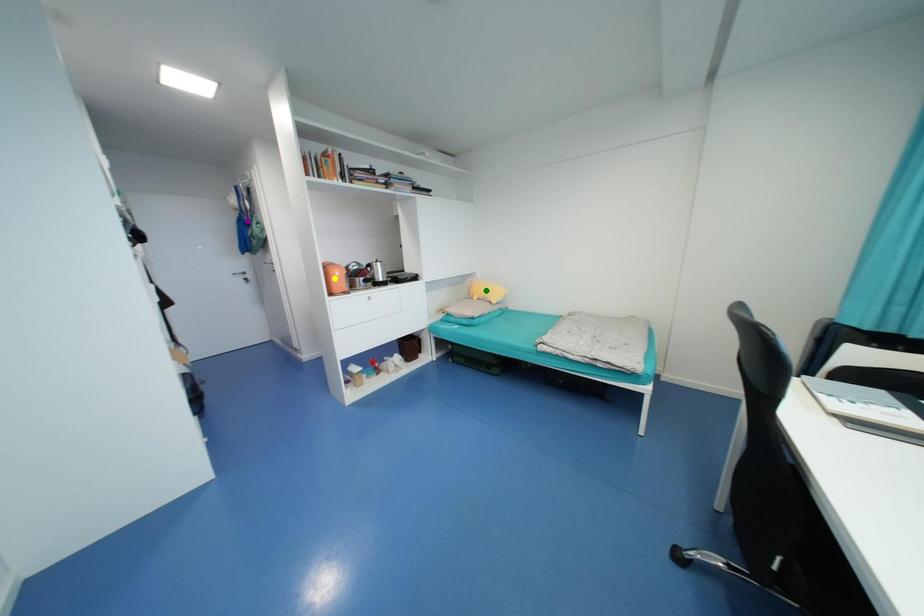
Order these from nearest to farthest:
- purple point
- green point
- yellow point

yellow point < purple point < green point